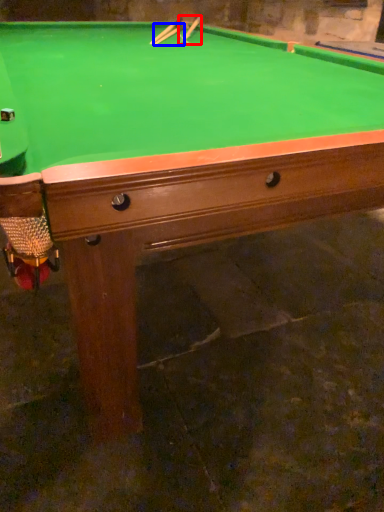
Question: Which object is further to the camera taking this photo, cue (highlighted by a red box) or cue (highlighted by a blue box)?

Choices:
 (A) cue
 (B) cue

Answer: (A)